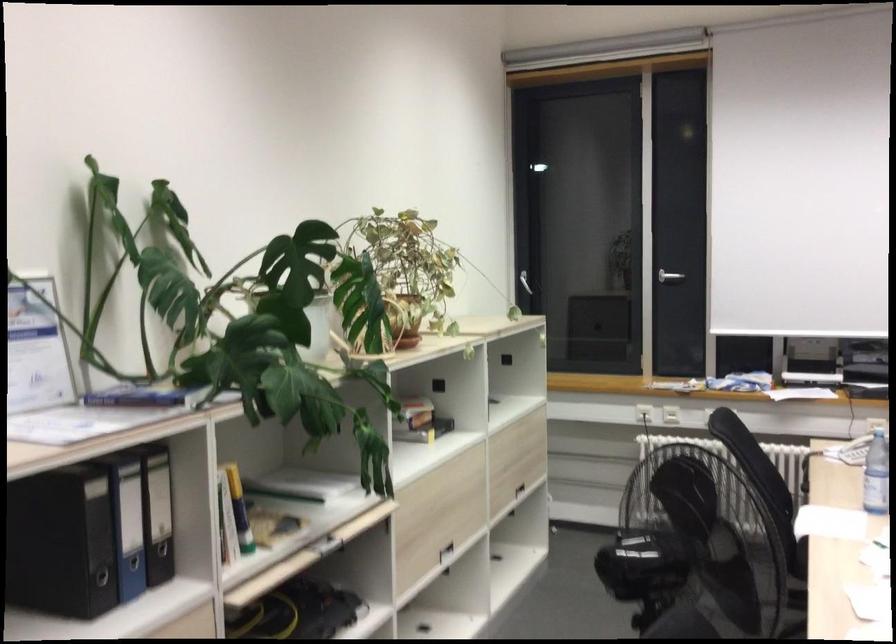
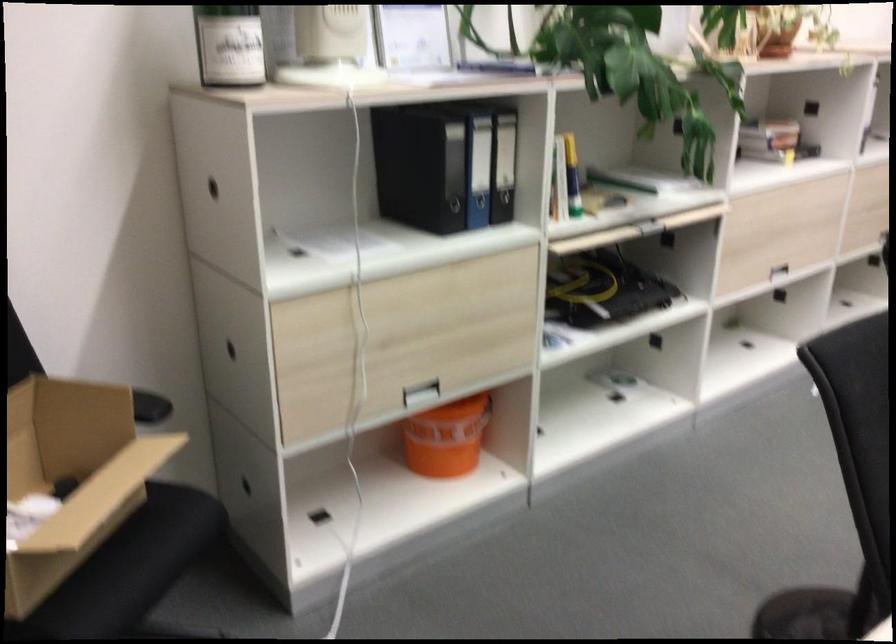
Locate, in the second image, the point that corresponds to point (445, 545) in the first image.

(771, 266)